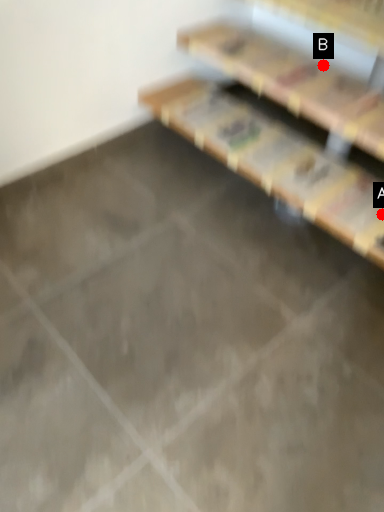
Question: Two points are circled on the image, labeled by A and B beside each circle. Which of the following is the closest to the observer?

Choices:
 (A) A is closer
 (B) B is closer

Answer: (A)